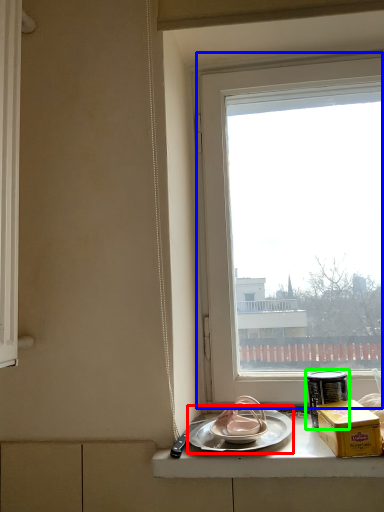
Question: Estimate the real-world distances between objects in this image. Which object is farther from plate (highlighted by a red box), window (highlighted by a blue box) or tableware (highlighted by a green box)?

Choices:
 (A) window
 (B) tableware

Answer: (A)